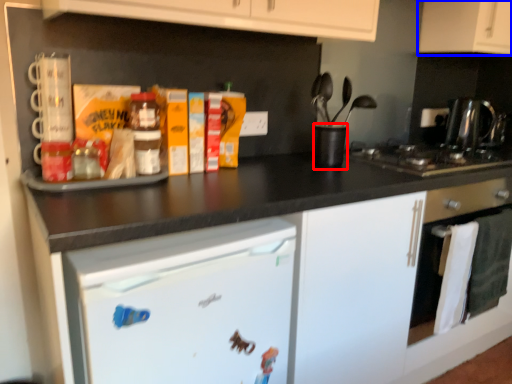
Question: Which of the following is the farthest to the observer, appliance (highlighted by a red box) or cabinetry (highlighted by a blue box)?

Choices:
 (A) appliance
 (B) cabinetry

Answer: (B)